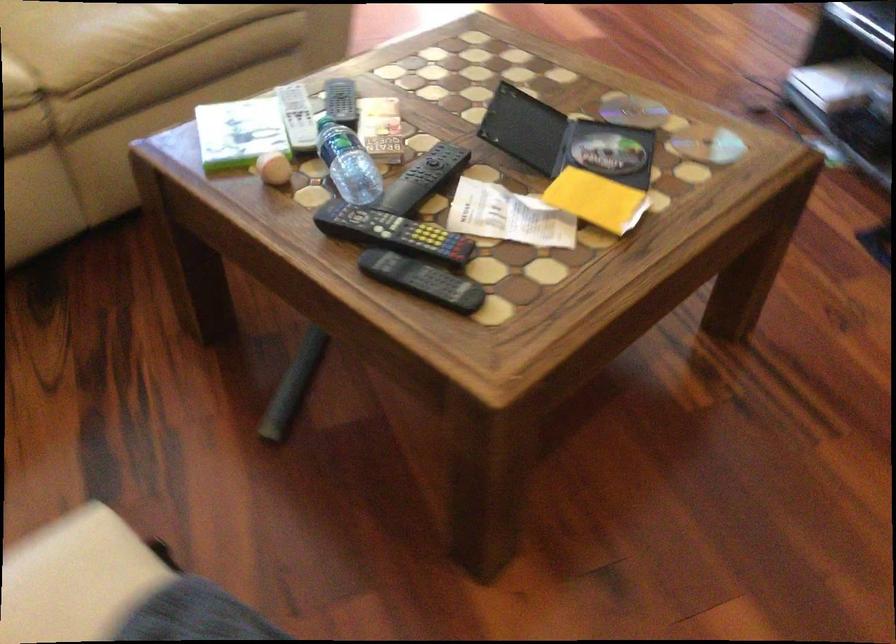
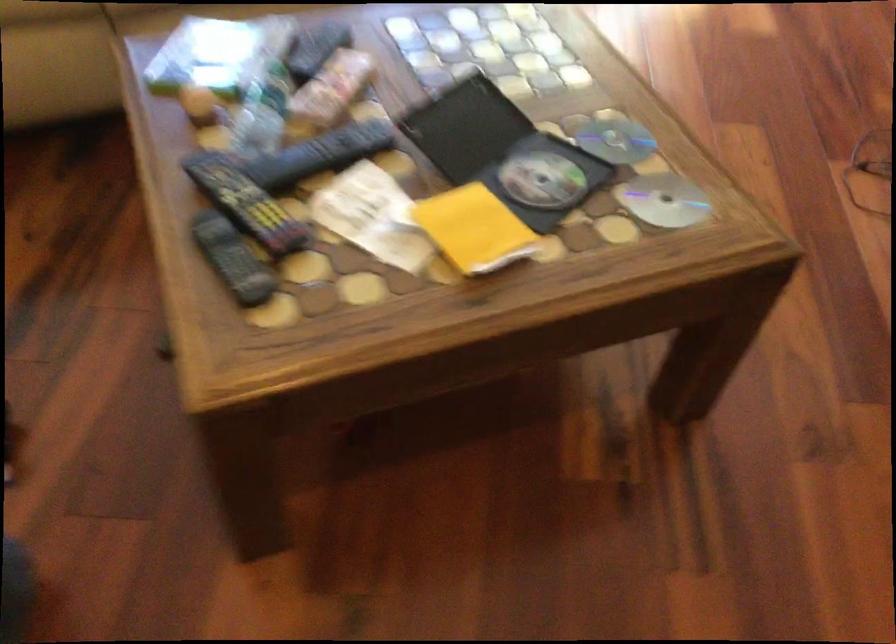
Question: I am providing you with two images of the same scene from different viewpoints. Please identify which objects are invisible in image2.

Choices:
 (A) yellow padded envelope
 (B) black remote control
 (C) black DVD case
 (D) none of these

Answer: (D)